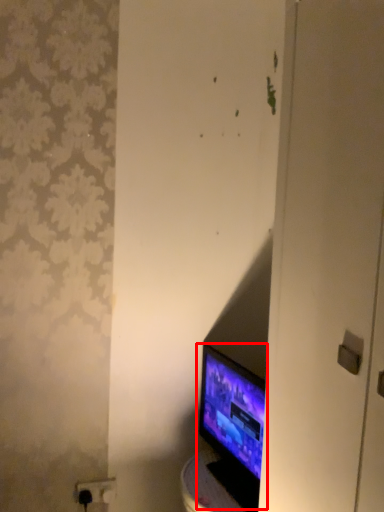
Question: From the image's perspective, what is the correct spatial relationship of computer monitor (annotated by the red box) in relation to electric outlet?

Choices:
 (A) above
 (B) below

Answer: (A)